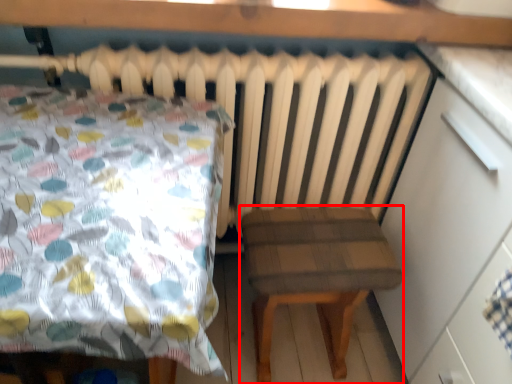
Question: Where is stool (annotated by the red box) located in relation to dresser in the image?

Choices:
 (A) left
 (B) right

Answer: (A)